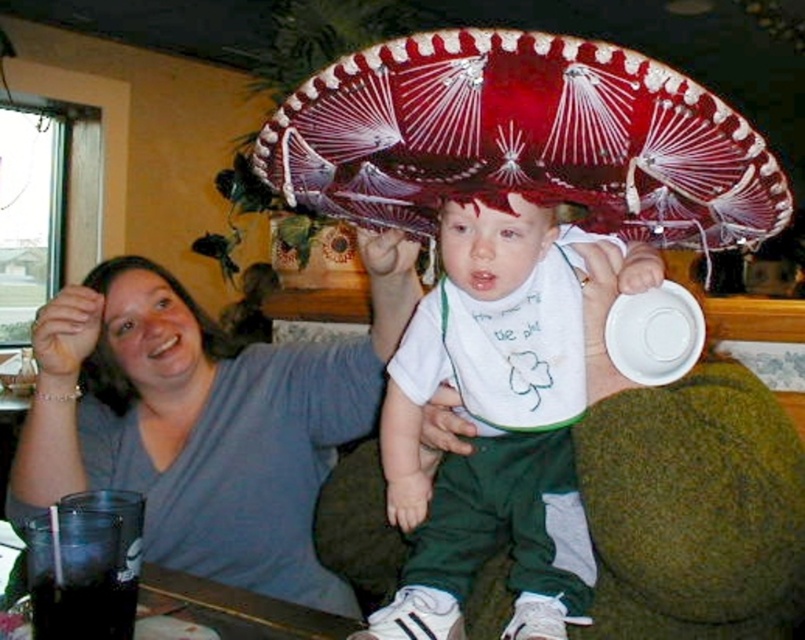
Question: Is white cotton bib at center to the left of matte red sombrero at center from the viewer's perspective?

Choices:
 (A) no
 (B) yes

Answer: (A)

Question: Does red felt sombrero at center have a greater width compared to white cotton bib at center?

Choices:
 (A) no
 (B) yes

Answer: (B)

Question: Which object appears farthest from the camera in this image?

Choices:
 (A) matte gray shirt at upper left
 (B) matte gray head at upper left

Answer: (B)

Question: Among these points, which one is nearest to the camera?

Choices:
 (A) (89, 378)
 (B) (638, 310)
 (C) (597, 209)

Answer: (B)

Question: Observing the image, what is the correct spatial positioning of red felt sombrero at center in reference to white cotton bib at center?

Choices:
 (A) below
 (B) above

Answer: (B)

Question: Which of the following is the farthest from the observer?

Choices:
 (A) matte gray shirt at upper left
 (B) matte gray head at upper left

Answer: (B)